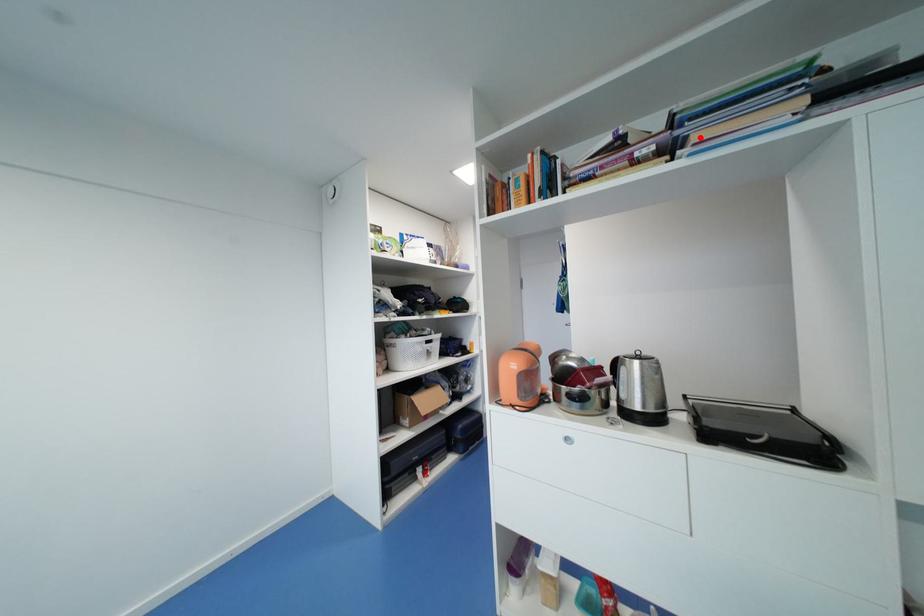
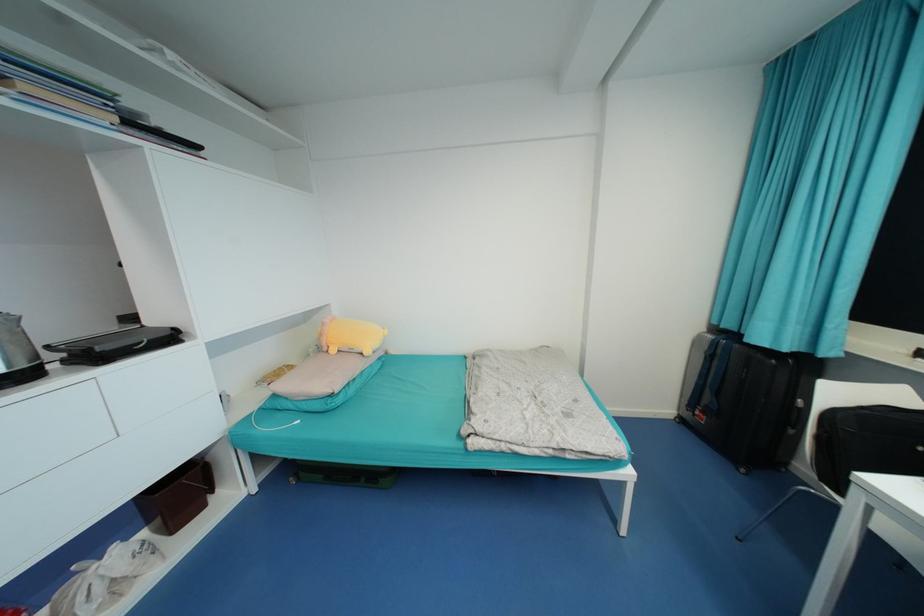
In the second image, find the point that corresponds to the highlighted location in the first image.

(28, 87)